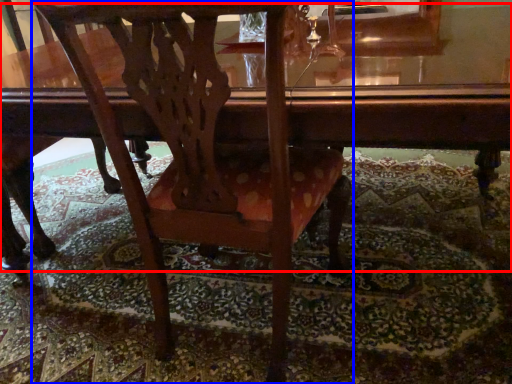
Question: Which of the following is the farthest to the observer, table (highlighted by a red box) or chair (highlighted by a blue box)?

Choices:
 (A) table
 (B) chair

Answer: (B)